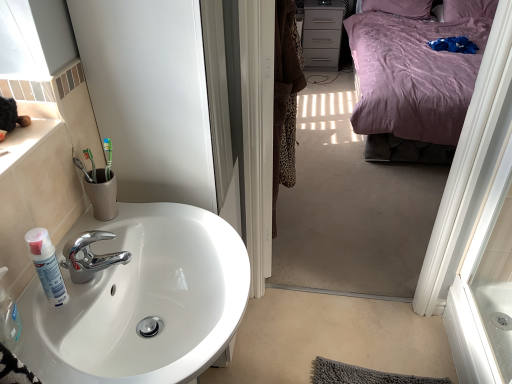
Question: Does green toothbrush at sink appear on the right side of white glossy sink at lower left?

Choices:
 (A) yes
 (B) no

Answer: (B)

Question: Does green toothbrush at sink have a greater width compared to white glossy sink at lower left?

Choices:
 (A) yes
 (B) no

Answer: (B)

Question: Is green toothbrush at sink aimed at white glossy sink at lower left?

Choices:
 (A) yes
 (B) no

Answer: (B)

Question: From a real-world perspective, is green toothbrush at sink located beneath white glossy sink at lower left?

Choices:
 (A) yes
 (B) no

Answer: (B)

Question: Is green toothbrush at sink positioned with its back to white glossy sink at lower left?

Choices:
 (A) no
 (B) yes

Answer: (A)

Question: Based on their sizes in the image, would you say matte gray cabinet at upper right is bigger or smaller than purple satin pillow at upper right?

Choices:
 (A) small
 (B) big

Answer: (B)

Question: Is matte gray cabinet at upper right taller or shorter than purple satin pillow at upper right?

Choices:
 (A) tall
 (B) short

Answer: (A)

Question: Considering their positions, is matte gray cabinet at upper right located in front of or behind purple satin pillow at upper right?

Choices:
 (A) behind
 (B) front

Answer: (A)

Question: From a real-world perspective, is matte gray cabinet at upper right positioned above or below purple satin pillow at upper right?

Choices:
 (A) above
 (B) below

Answer: (B)

Question: In terms of size, does white matte spray can at sink left appear bigger or smaller than matte gray cabinet at upper right?

Choices:
 (A) small
 (B) big

Answer: (A)

Question: Is white matte spray can at sink left inside the boundaries of matte gray cabinet at upper right, or outside?

Choices:
 (A) inside
 (B) outside

Answer: (B)

Question: Visually, is white matte spray can at sink left positioned to the left or to the right of matte gray cabinet at upper right?

Choices:
 (A) left
 (B) right

Answer: (A)

Question: Considering the positions of white matte spray can at sink left and matte gray cabinet at upper right in the image, is white matte spray can at sink left wider or thinner than matte gray cabinet at upper right?

Choices:
 (A) wide
 (B) thin

Answer: (B)

Question: In the image, is white glossy sink at lower left on the left side or the right side of matte gray cabinet at upper right?

Choices:
 (A) right
 (B) left

Answer: (B)

Question: From a real-world perspective, is white glossy sink at lower left positioned above or below matte gray cabinet at upper right?

Choices:
 (A) above
 (B) below

Answer: (A)